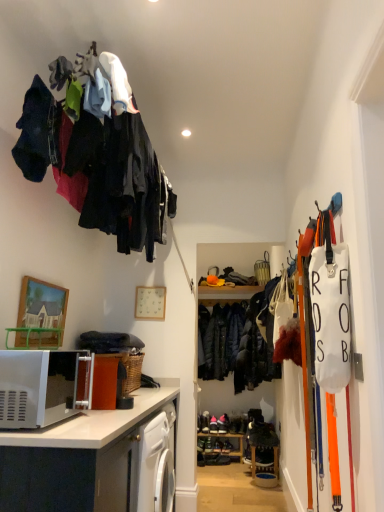
Question: From the image's perspective, is wooden shelf at lower center positioned above or below black leather shoes at center, positioned as the 2th footwear in left-to-right order?

Choices:
 (A) above
 (B) below

Answer: (B)

Question: Considering the positions of wooden shelf at lower center and black leather shoes at center, positioned as the 2th footwear in left-to-right order, in the image, is wooden shelf at lower center wider or thinner than black leather shoes at center, positioned as the 2th footwear in left-to-right order,?

Choices:
 (A) thin
 (B) wide

Answer: (A)

Question: Based on their relative distances, which object is farther from the wooden shelf at lower center?

Choices:
 (A) dark blue quilted jacket at center, positioned as the 2th clothing in top-to-bottom order
 (B) black leather shoes at center, which is the first footwear from right to left
 (C) dark blue fabric at upper left, acting as the 1th clothing starting from the top
 (D) wooden picture frame at upper left
 (E) white glossy microwave at lower left

Answer: (C)

Question: Which object is positioned farthest from the dark brown leather shoes at center, which is the 1th footwear in left-to-right order?

Choices:
 (A) dark blue quilted jacket at center, marked as the 1th clothing in a bottom-to-top arrangement
 (B) dark blue fabric at upper left, the 2th clothing in the back-to-front sequence
 (C) black leather shoes at center, positioned as the 2th footwear in left-to-right order
 (D) white glossy microwave at lower left
 (E) wooden picture frame at upper left

Answer: (B)